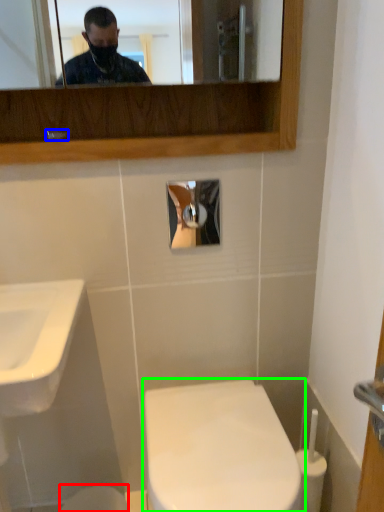
Question: Which is nearer to the toilet bowl (highlighted by a red box)? faucet (highlighted by a blue box) or toilet (highlighted by a green box).

Choices:
 (A) faucet
 (B) toilet

Answer: (B)